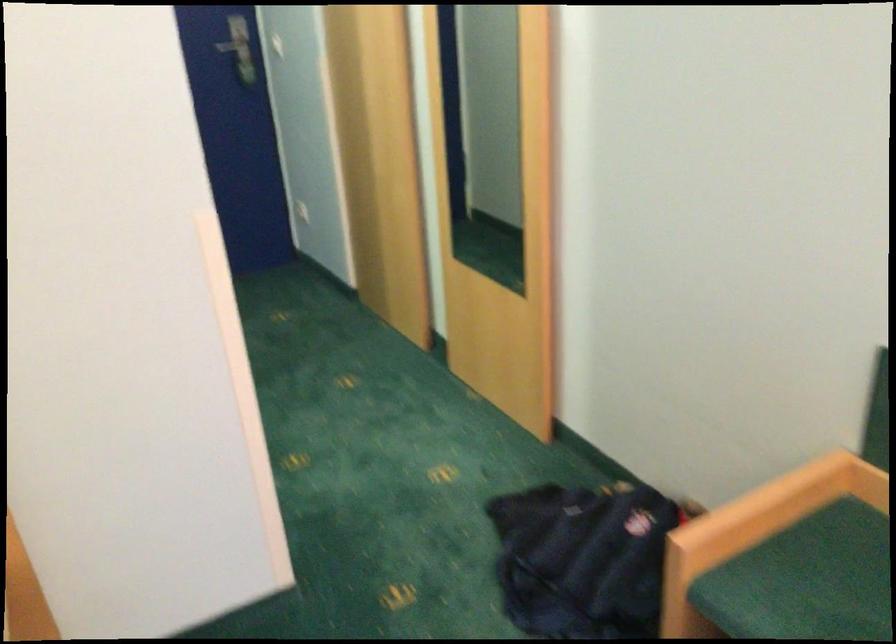
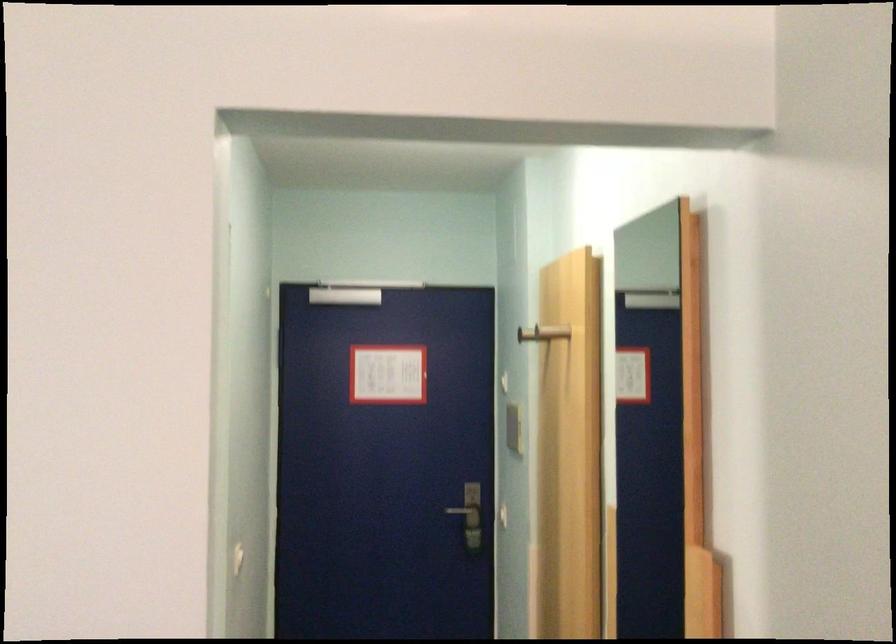
Where in the second image is the point corresponding to [251,69] from the first image?

(470, 526)